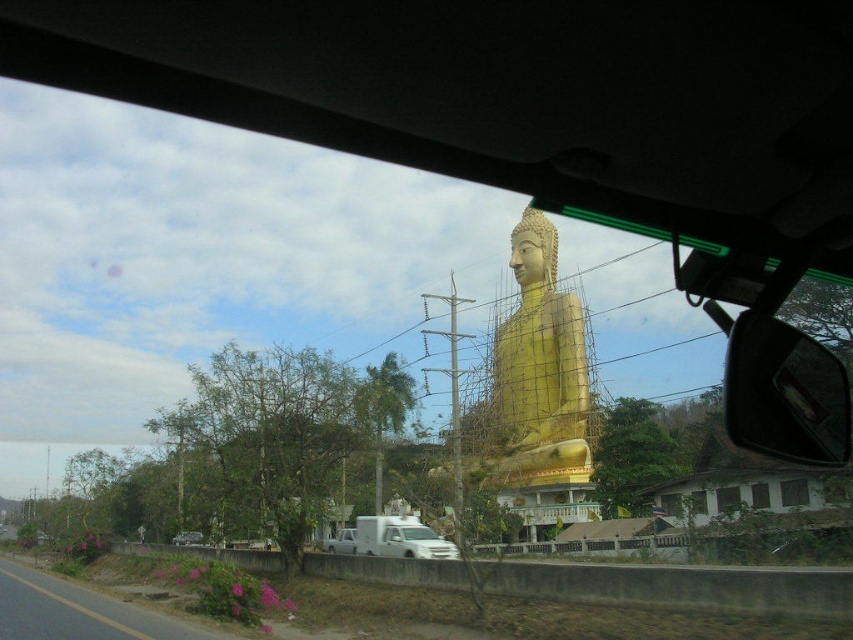
You are a photographer trying to capture a photo of the gold polished statue at center from inside the metallic silver car at lower left. Considering the height difference between them, will the statue be fully visible in your photo without any obstruction?

The gold polished statue at center is taller than the metallic silver car at lower left. Since the statue is taller, it will likely be visible above the car, but whether it is fully visible depends on the angle and positioning of the camera. However, based on height alone, the statue should not be obstructed by the car itself.

You are driving a car and notice the glossy plastic side mirror at right and the metallic silver car at lower left in your view. Which object is positioned higher in the scene?

The glossy plastic side mirror at right is positioned higher than the metallic silver car at lower left according to the description.